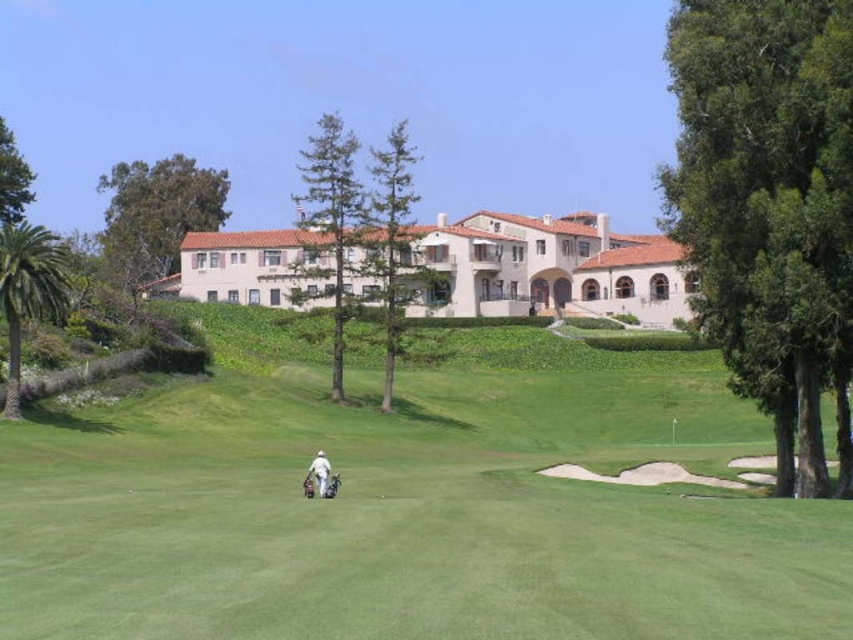
You are a golfer standing at the edge of the green grassy golf course at center and want to place your white fabric golf bag at center on the course. Can you determine if the golf course is wide enough to accommodate the bag?

The green grassy golf course at center might be wider than the white fabric golf bag at center, so it is possible that the course is wide enough to place the bag there.

You are a drone operator trying to capture a photo of the green grassy golf course at center and the white fabric golf bag at center. Which object should you focus on first if you want to ensure both are in focus?

The green grassy golf course at center is closer to the viewer than the white fabric golf bag at center, so you should focus on the green grassy golf course at center first to ensure both are in focus.

You are a drone operator tasked with capturing aerial footage of the green grassy golf course at center and the white fabric golf bag at center. Which object would require a wider camera frame to fully capture in the image?

The green grassy golf course at center has a larger size compared to the white fabric golf bag at center, so the drone operator would need a wider camera frame to fully capture the green grassy golf course at center.